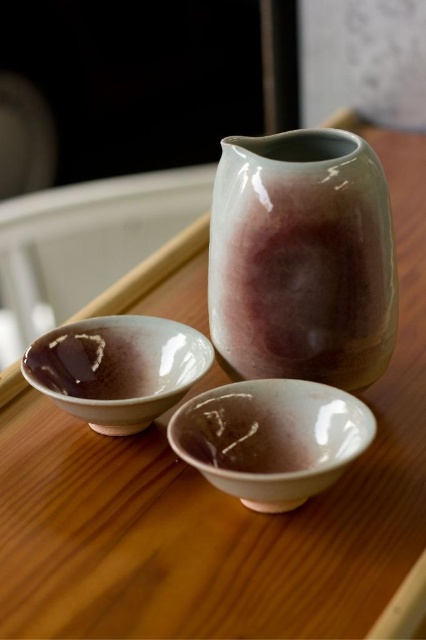
Question: Among these points, which one is nearest to the camera?

Choices:
 (A) (167, 358)
 (B) (368, 435)
 (C) (244, 342)

Answer: (B)

Question: Can you confirm if matte ceramic vase at center is thinner than matte porcelain bowl at lower center?

Choices:
 (A) no
 (B) yes

Answer: (A)

Question: Which point is closer to the camera?

Choices:
 (A) matte ceramic vase at center
 (B) matte porcelain bowl at lower center

Answer: (B)

Question: Can you confirm if matte porcelain bowl at lower center is bigger than matte ceramic bowl at center?

Choices:
 (A) no
 (B) yes

Answer: (A)

Question: Can you confirm if matte porcelain bowl at lower center is positioned above matte ceramic bowl at center?

Choices:
 (A) yes
 (B) no

Answer: (B)

Question: Which of these objects is positioned farthest from the matte porcelain bowl at lower center?

Choices:
 (A) matte ceramic bowl at center
 (B) matte ceramic vase at center

Answer: (B)